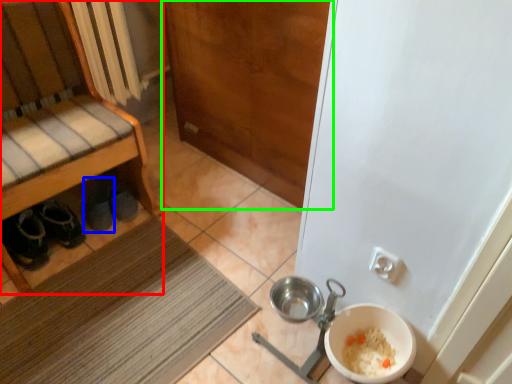
Question: Considering the real-world distances, which object is closest to cabinetry (highlighted by a red box)? footwear (highlighted by a blue box) or door (highlighted by a green box).

Choices:
 (A) footwear
 (B) door

Answer: (A)